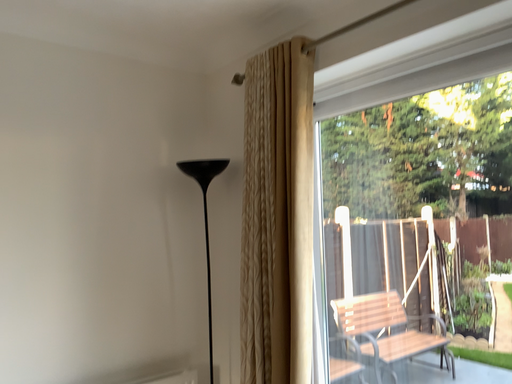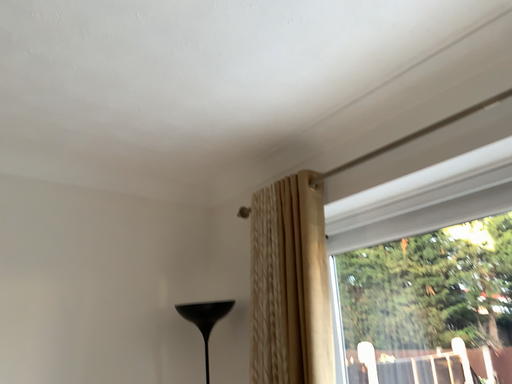
Question: Which way did the camera rotate in the video?

Choices:
 (A) rotated downward
 (B) rotated upward

Answer: (B)